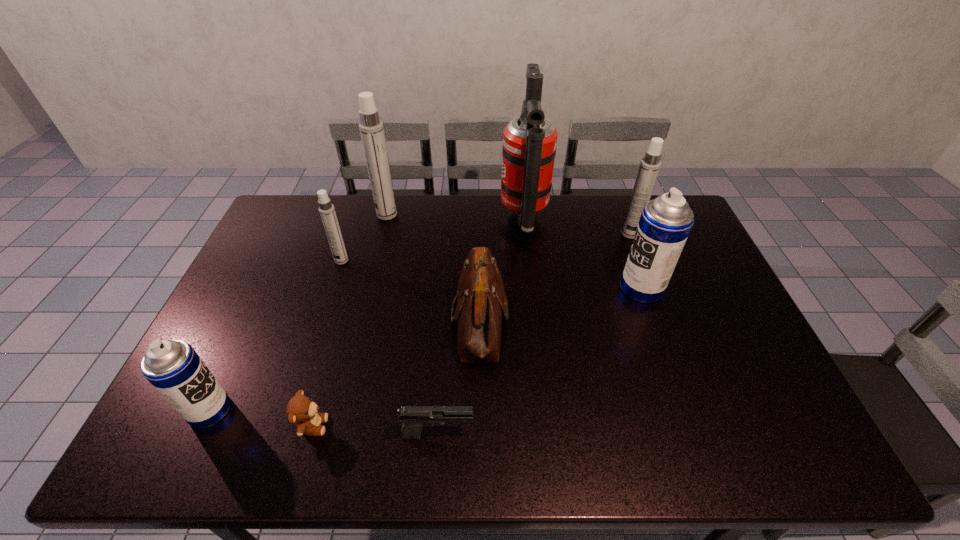
Choose which white aerosol can is the nearest neighbor to the brown shoulder bag. Please provide its 2D coordinates. Your answer should be formatted as a tuple, i.e. [(x, y)], where the tuple contains the x and y coordinates of a point satisfying the conditions above.

[(326, 209)]

Image resolution: width=960 pixels, height=540 pixels. I want to click on vacant region that satisfies the following two spatial constraints: 1. on the front side of the shoulder bag; 2. on the left side of the biggest white aerosol can, so click(361, 320).